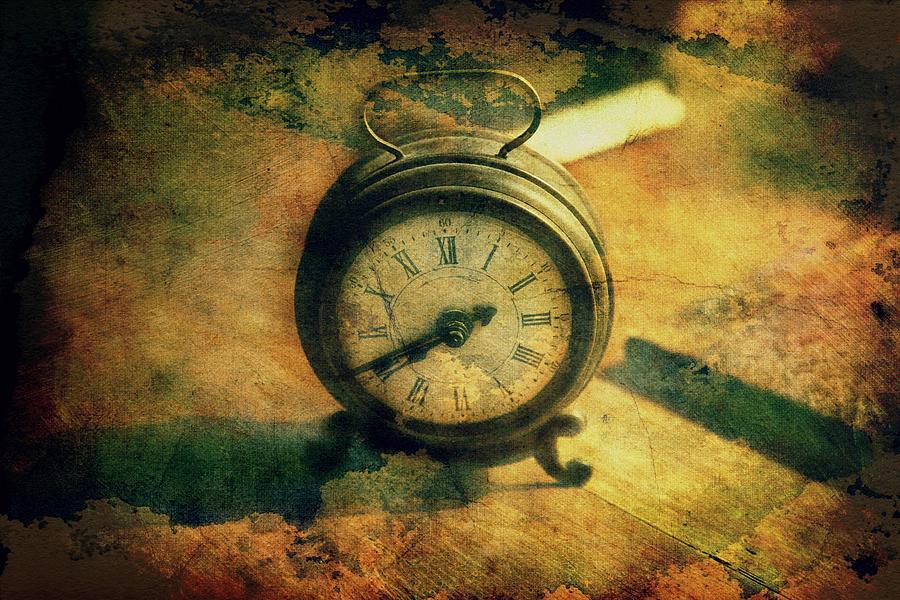
Where is `second hand of alarm clock on the number 8`? second hand of alarm clock on the number 8 is located at coordinates (382, 369).